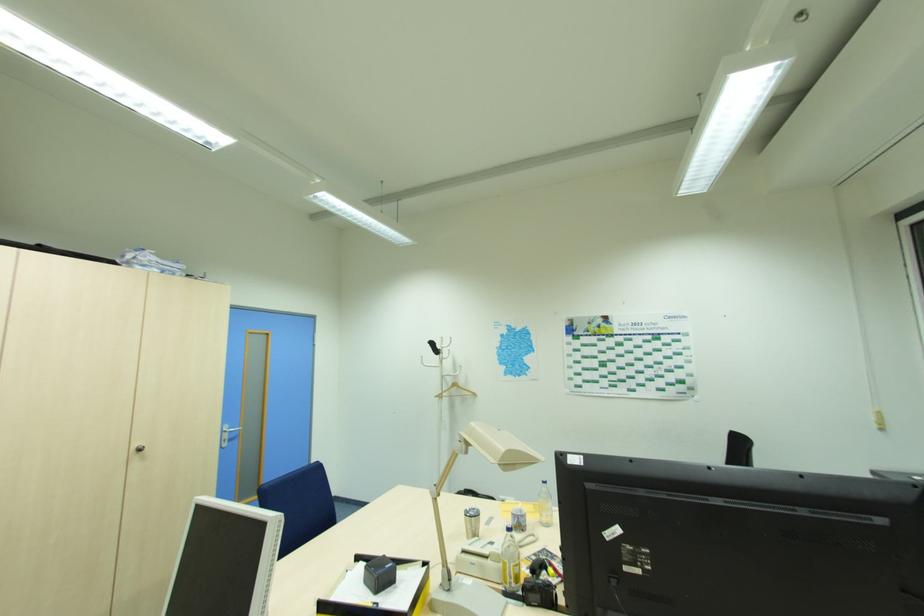
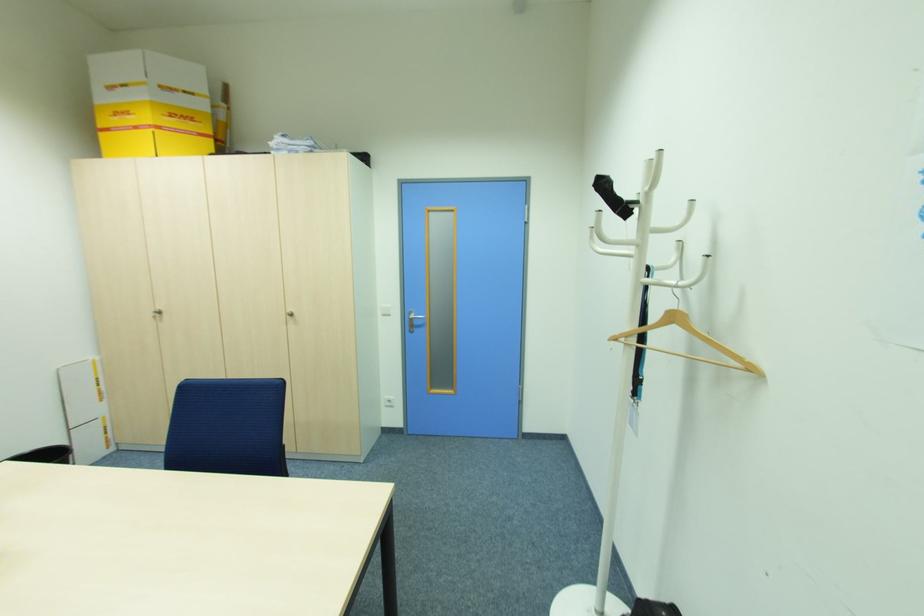
Find the pixel in the second image that matches [137,446] in the first image.

(292, 310)